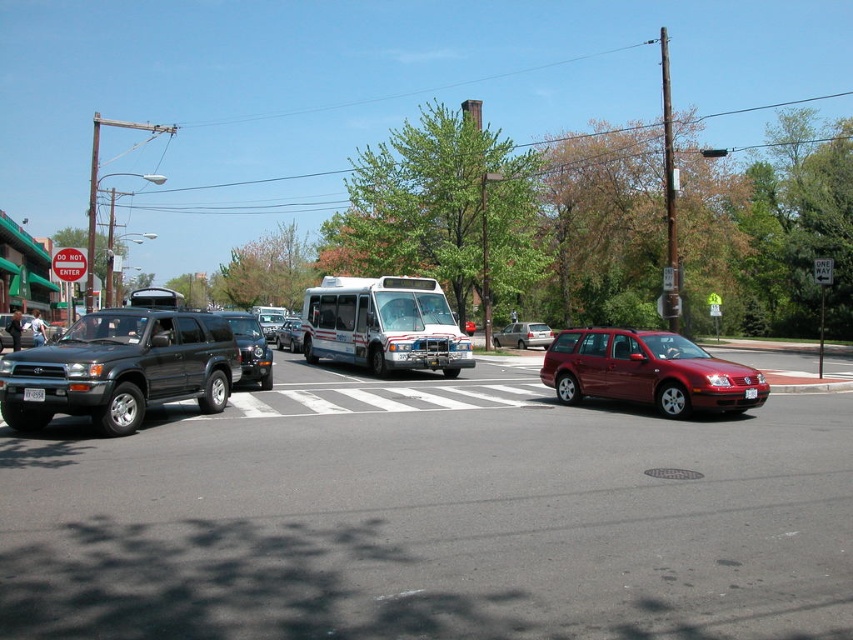
In the scene shown: You are a delivery person trying to load a package onto the roof of the vehicle. The package is 1.8 meters tall. Which vehicle between the white glossy bus at center and the metallic red sedan at center can safely accommodate the package without exceeding its height?

The white glossy bus at center is taller than the metallic red sedan at center. Therefore, the package can be safely placed on the roof of the white glossy bus at center as it has sufficient height clearance.

You are a pedestrian standing at the crosswalk. You see the metallic silver suv at center and the white plastic license plate at center. Which object is larger?

The metallic silver suv at center is bigger than the white plastic license plate at center.